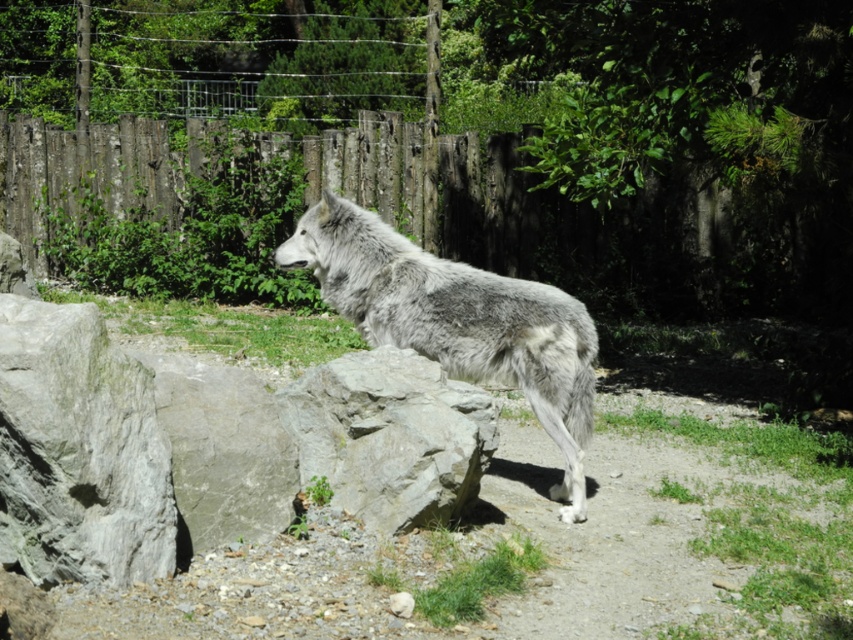
In the scene shown: Can you confirm if gray rough rock at lower left is taller than gray fur wolf at center?

No.

Between point (136, 422) and point (384, 227), which one is positioned behind?

Point (384, 227)

Locate an element on the screen. The height and width of the screenshot is (640, 853). gray rough rock at lower left is located at coordinates (79, 451).

Who is taller, gray rough rock at lower left or gray rough rock at center?

With more height is gray rough rock at lower left.

Describe the element at coordinates (79, 451) in the screenshot. I see `gray rough rock at lower left` at that location.

At what (x,y) coordinates should I click in order to perform the action: click on gray rough rock at lower left. Please return your answer as a coordinate pair (x, y). Looking at the image, I should click on (79, 451).

Can you confirm if gray fur wolf at center is positioned above gray rough rock at center?

Indeed, gray fur wolf at center is positioned over gray rough rock at center.

Who is more distant from viewer, (376, 323) or (370, 484)?

Positioned behind is point (376, 323).

Between point (570, 468) and point (332, 396), which one is positioned behind?

Positioned behind is point (570, 468).

Where is `gray fur wolf at center`? gray fur wolf at center is located at coordinates (457, 321).